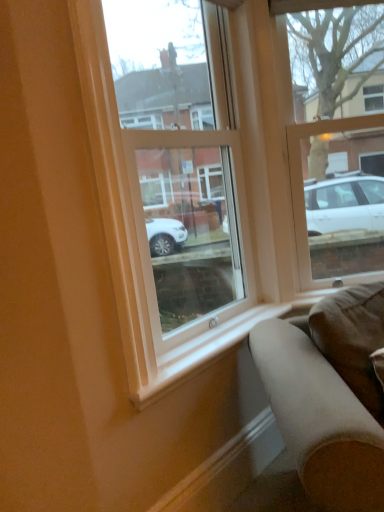
You are a GUI agent. You are given a task and a screenshot of the screen. Output one action in this format:
    pyautogui.click(x=<x>, y=<y>)
    Task: Click on the empty space that is ontop of white smooth window sill at lower center (from a real-world perspective)
    The height and width of the screenshot is (512, 384).
    Given the screenshot: What is the action you would take?
    pyautogui.click(x=229, y=331)